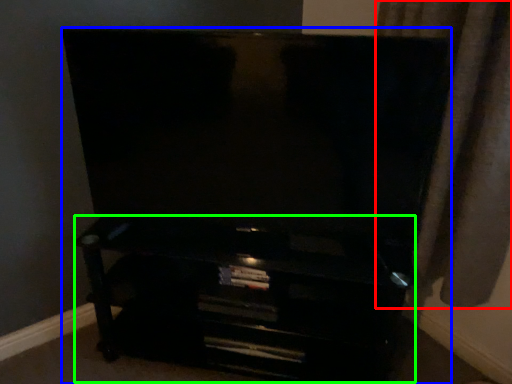
Question: Which object is the closest to the curtain (highlighted by a red box)? Choose among these: furniture (highlighted by a blue box) or entertainment center (highlighted by a green box).

Choices:
 (A) furniture
 (B) entertainment center

Answer: (A)